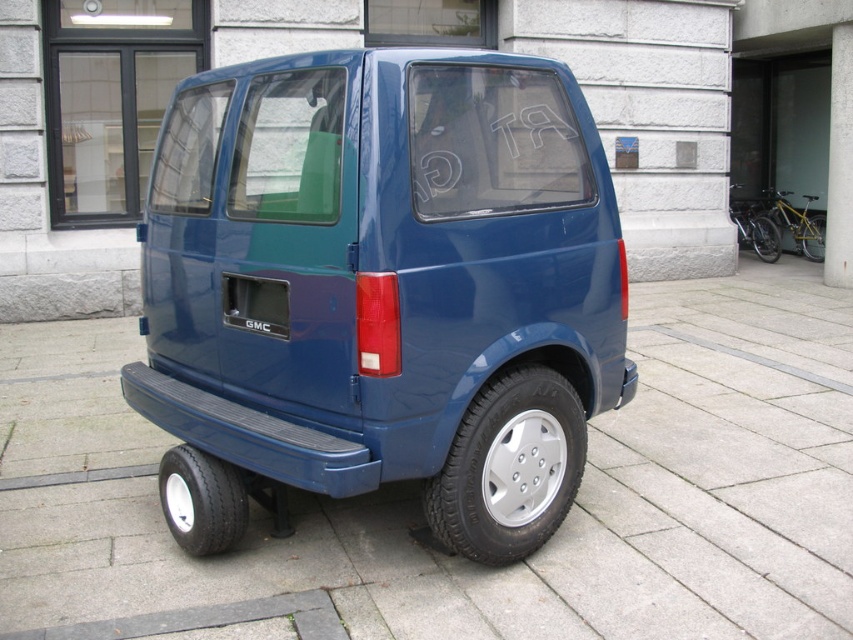
Is black rubber tire at lower left bigger than yellow matte bicycle at right?

No, black rubber tire at lower left is not bigger than yellow matte bicycle at right.

Can you confirm if black rubber tire at lower left is positioned below yellow matte bicycle at right?

Yes.

Locate an element on the screen. This screenshot has width=853, height=640. black rubber tire at lower left is located at coordinates (201, 500).

Can you confirm if glossy blue van at center is taller than matte blue bumper at rear?

Yes.

What do you see at coordinates (387, 282) in the screenshot?
I see `glossy blue van at center` at bounding box center [387, 282].

Find the location of `glossy blue van at center`. glossy blue van at center is located at coordinates click(387, 282).

Identify the location of yellow matte bicycle at right. Image resolution: width=853 pixels, height=640 pixels. (798, 221).

Identify the location of yellow matte bicycle at right. Image resolution: width=853 pixels, height=640 pixels. (798, 221).